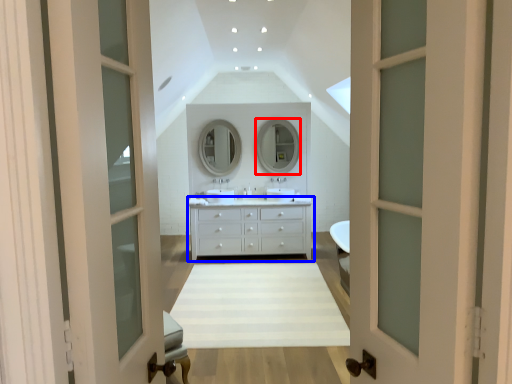
Question: Which object appears farthest to the camera in this image, mirror (highlighted by a red box) or chest of drawers (highlighted by a blue box)?

Choices:
 (A) mirror
 (B) chest of drawers

Answer: (A)